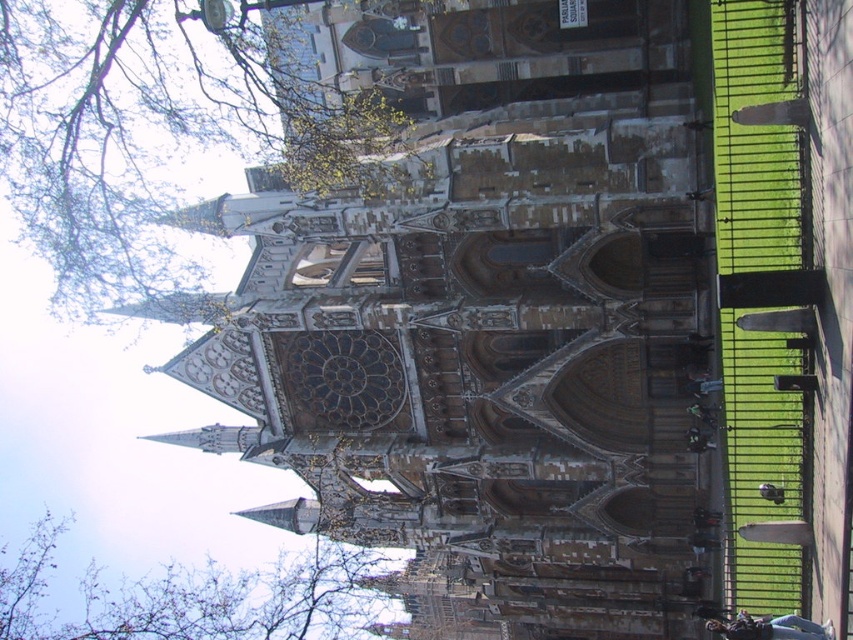
The image size is (853, 640). Describe the element at coordinates (158, 128) in the screenshot. I see `green leafy tree at upper left` at that location.

Measure the distance between green leafy tree at upper left and bare branches at upper left.

43.02 meters

Locate an element on the screen. The image size is (853, 640). green leafy tree at upper left is located at coordinates (158, 128).

Does brown stone tower at center have a greater width compared to green leafy tree at upper left?

Indeed, brown stone tower at center has a greater width compared to green leafy tree at upper left.

Is point (686, 417) more distant than point (206, 12)?

Yes, point (686, 417) is farther from viewer.

Is point (469, 625) more distant than point (160, 240)?

Yes.

You are a GUI agent. You are given a task and a screenshot of the screen. Output one action in this format:
    pyautogui.click(x=<x>, y=<y>)
    Task: Click on the brown stone tower at center
    This screenshot has width=853, height=640.
    Given the screenshot: What is the action you would take?
    pyautogui.click(x=486, y=316)

Does point (695, 160) come in front of point (80, 632)?

Yes, it is in front of point (80, 632).

Between brown stone tower at center and bare branches at upper left, which one is positioned higher?

Positioned higher is brown stone tower at center.

Who is more forward, (526, 321) or (314, 609)?

Point (526, 321) is in front.

At what (x,y) coordinates should I click in order to perform the action: click on brown stone tower at center. Please return your answer as a coordinate pair (x, y). This screenshot has width=853, height=640. Looking at the image, I should click on (486, 316).